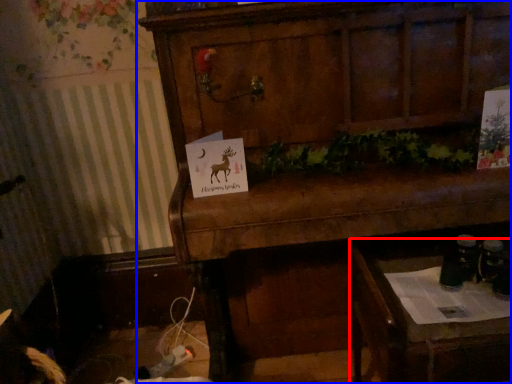
Question: Which object appears closest to the camera in this image, table (highlighted by a red box) or furniture (highlighted by a blue box)?

Choices:
 (A) table
 (B) furniture

Answer: (B)